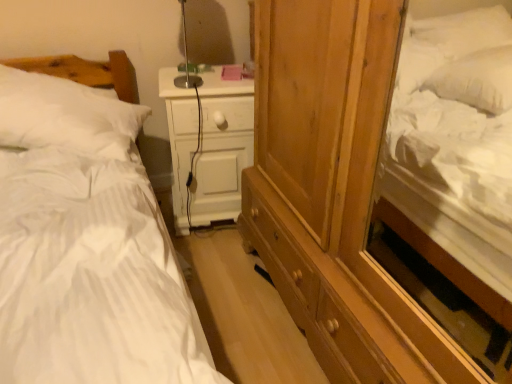
In order to face white striped fabric bed at left, should I rotate leftwards or rightwards?

Turn left approximately 21.113 degrees to face it.

The image size is (512, 384). What do you see at coordinates (65, 115) in the screenshot?
I see `white soft pillow at left` at bounding box center [65, 115].

The width and height of the screenshot is (512, 384). Describe the element at coordinates (222, 147) in the screenshot. I see `white matte nightstand at center` at that location.

Where is `white striped fabric bed at left`? The width and height of the screenshot is (512, 384). white striped fabric bed at left is located at coordinates (86, 246).

From a real-world perspective, relative to white matte nightstand at center, is white striped fabric bed at left vertically above or below?

From a real-world perspective, white striped fabric bed at left is physically above white matte nightstand at center.

From the image's perspective, which is above, white striped fabric bed at left or white matte nightstand at center?

white matte nightstand at center, from the image's perspective.

Is point (32, 184) positioned before point (216, 157)?

Yes, it is.

Is white soft pillow at left positioned behind white matte nightstand at center?

That is False.

Which of these two, white soft pillow at left or white matte nightstand at center, is thinner?

With smaller width is white matte nightstand at center.

From the picture: Could you tell me if white soft pillow at left is turned towards white matte nightstand at center?

No, white soft pillow at left is not aimed at white matte nightstand at center.

Measure the distance from white soft pillow at left to white matte nightstand at center.

white soft pillow at left and white matte nightstand at center are 36.51 centimeters apart from each other.

Is white striped fabric bed at left facing towards white soft pillow at left?

No, white striped fabric bed at left is not oriented towards white soft pillow at left.

Considering the sizes of objects white striped fabric bed at left and white soft pillow at left in the image provided, who is thinner, white striped fabric bed at left or white soft pillow at left?

With smaller width is white soft pillow at left.

From the image's perspective, is white striped fabric bed at left above or below white soft pillow at left?

white striped fabric bed at left is situated lower than white soft pillow at left in the image.

Would you say white striped fabric bed at left is outside white soft pillow at left?

Yes, white striped fabric bed at left is not within white soft pillow at left.

Does white matte nightstand at center appear on the left side of white soft pillow at left?

In fact, white matte nightstand at center is to the right of white soft pillow at left.

From a real-world perspective, is white matte nightstand at center physically located above or below white soft pillow at left?

white matte nightstand at center is situated lower than white soft pillow at left in the real world.

From the image's perspective, which one is positioned higher, white matte nightstand at center or white soft pillow at left?

white soft pillow at left appears higher in the image.

Can you tell me how much white matte nightstand at center and white soft pillow at left differ in facing direction?

The facing directions of white matte nightstand at center and white soft pillow at left are 10.2 degrees apart.

Is white soft pillow at left smaller than white striped fabric bed at left?

Yes.

Who is more distant, white soft pillow at left or white striped fabric bed at left?

white soft pillow at left.

Is white soft pillow at left facing away from white striped fabric bed at left?

Yes, white soft pillow at left's orientation is away from white striped fabric bed at left.

How different are the orientations of white soft pillow at left and white striped fabric bed at left in degrees?

The facing directions of white soft pillow at left and white striped fabric bed at left are 19.7 degrees apart.

Is white matte nightstand at center aimed at white striped fabric bed at left?

No, white matte nightstand at center is not facing towards white striped fabric bed at left.

Who is more distant, white matte nightstand at center or white striped fabric bed at left?

white matte nightstand at center is more distant.

In the scene shown: Who is bigger, white matte nightstand at center or white striped fabric bed at left?

Bigger between the two is white striped fabric bed at left.

Find the location of a particular element. The height and width of the screenshot is (384, 512). bed above the white matte nightstand at center (from a real-world perspective) is located at coordinates (86, 246).

This screenshot has height=384, width=512. In the image, there is a white soft pillow at left. Identify the location of nightstand below it (from a real-world perspective). (222, 147).

Estimate the real-world distances between objects in this image. Which object is further from white striped fabric bed at left, white matte nightstand at center or white soft pillow at left?

white matte nightstand at center lies further to white striped fabric bed at left than the other object.

From the image, which object appears to be farther from white striped fabric bed at left, white soft pillow at left or white matte nightstand at center?

white matte nightstand at center.

Based on the photo, considering their positions, is white matte nightstand at center positioned further to white soft pillow at left than white striped fabric bed at left?

white matte nightstand at center is positioned further to the anchor white soft pillow at left.

Considering their positions, is white soft pillow at left positioned closer to white matte nightstand at center than white striped fabric bed at left?

The object closer to white matte nightstand at center is white soft pillow at left.

Which object lies nearer to the anchor point white matte nightstand at center, white striped fabric bed at left or white soft pillow at left?

The object closer to white matte nightstand at center is white soft pillow at left.

Looking at the image, which one is located further to white soft pillow at left, white striped fabric bed at left or white matte nightstand at center?

Among the two, white matte nightstand at center is located further to white soft pillow at left.

Where is `pillow located between white striped fabric bed at left and white matte nightstand at center in the depth direction`? The width and height of the screenshot is (512, 384). pillow located between white striped fabric bed at left and white matte nightstand at center in the depth direction is located at coordinates (65, 115).